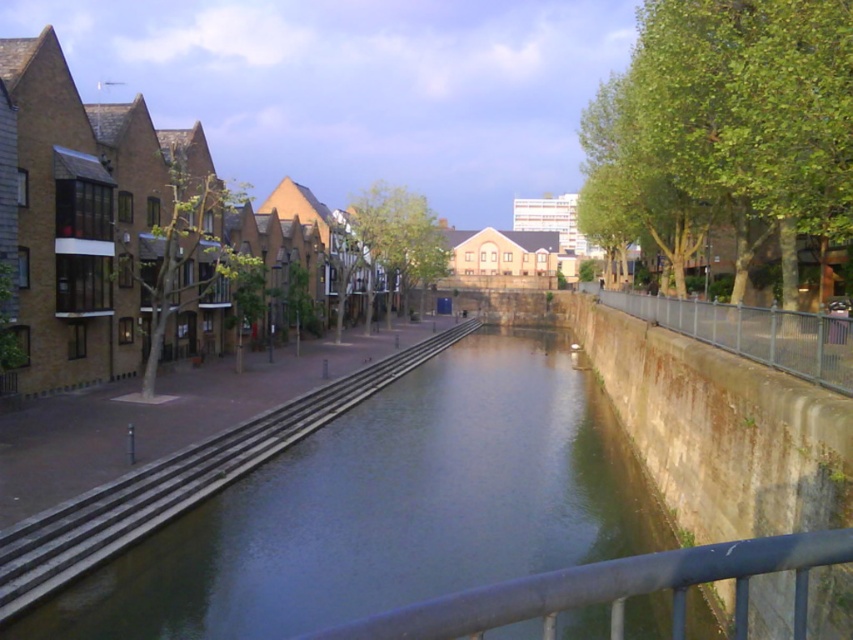
Question: Estimate the real-world distances between objects in this image. Which object is farther from the smooth metal railing at center?

Choices:
 (A) smooth concrete steps at center
 (B) rusty metal fence at right

Answer: (A)

Question: Is smooth metal railing at center above rusty metal fence at right?

Choices:
 (A) yes
 (B) no

Answer: (B)

Question: Is smooth concrete steps at center to the right of rusty metal fence at right from the viewer's perspective?

Choices:
 (A) no
 (B) yes

Answer: (A)

Question: Considering the real-world distances, which object is closest to the smooth concrete steps at center?

Choices:
 (A) rusty metal fence at right
 (B) smooth metal railing at center

Answer: (B)

Question: Can you confirm if smooth concrete steps at center is positioned to the right of smooth metal railing at center?

Choices:
 (A) yes
 (B) no

Answer: (B)

Question: Which of the following is the closest to the observer?

Choices:
 (A) smooth concrete steps at center
 (B) smooth metal railing at center

Answer: (B)